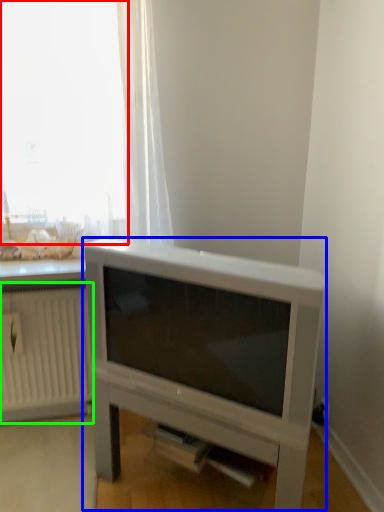
Question: Which object is positioned closest to window (highlighted by a red box)? Select from entertainment center (highlighted by a blue box) and radiator (highlighted by a green box).

Choices:
 (A) entertainment center
 (B) radiator

Answer: (A)